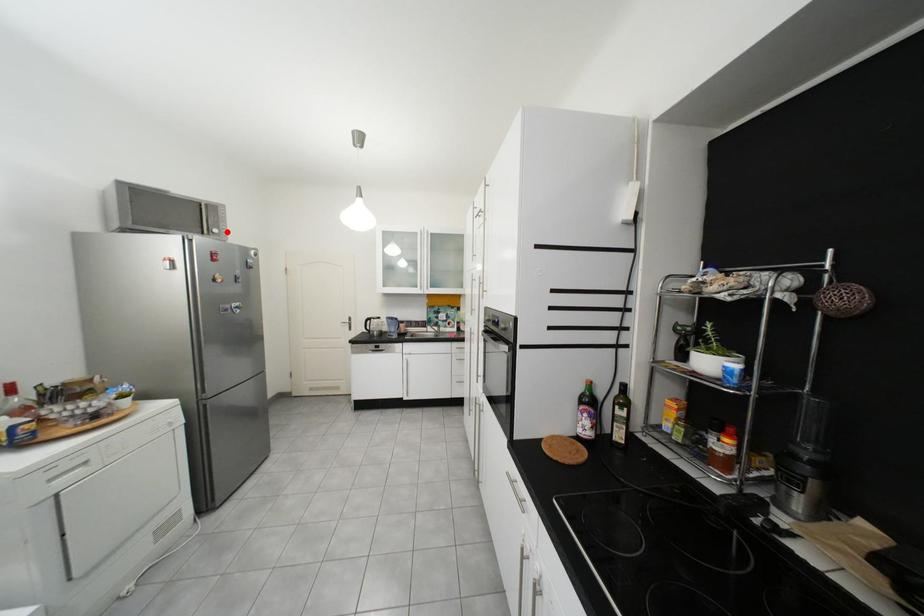
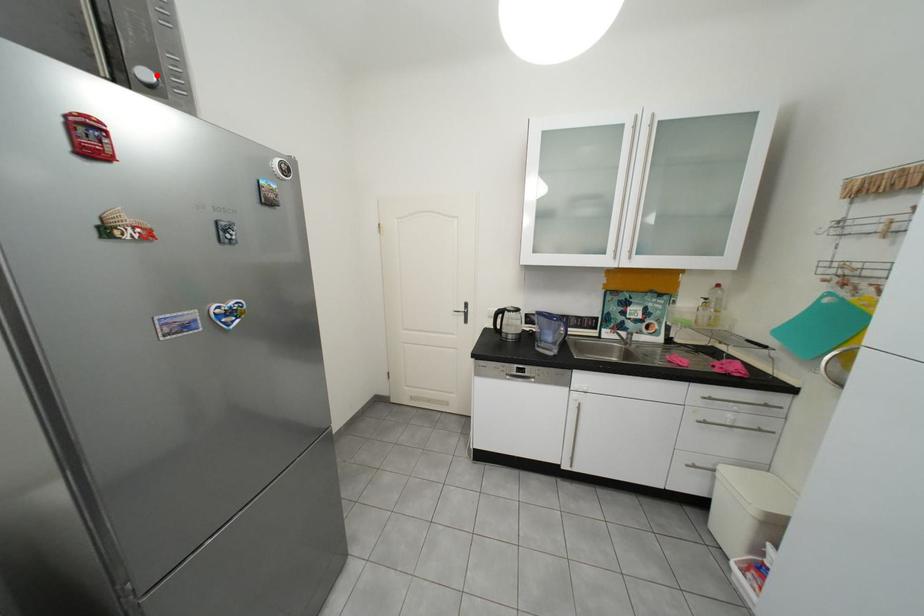
I am providing you with two images of the same scene from different viewpoints. A red point is marked on the first image and another point is marked on the second image. Are the points marked in image1 and image2 representing the same 3D position?

Yes